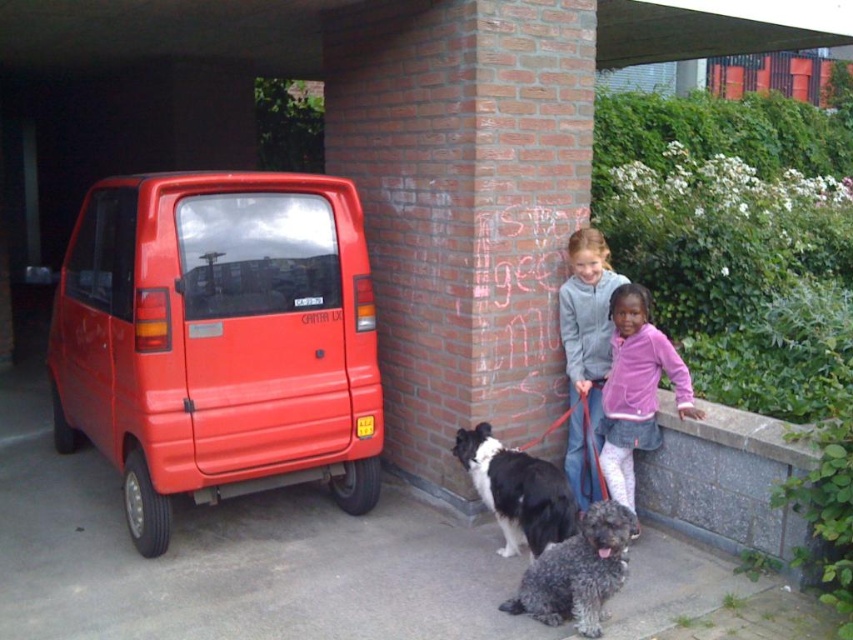
You are standing in front of the brick pillar with graffiti and want to determine the position of two points marked in the image. Which of the two points, point 1 at coordinates (567,476) or point 2 at (517,468), is closer to you?

Point 1 at coordinates (567,476) is closer to you because it is further to the viewer than point 2 at (517,468).